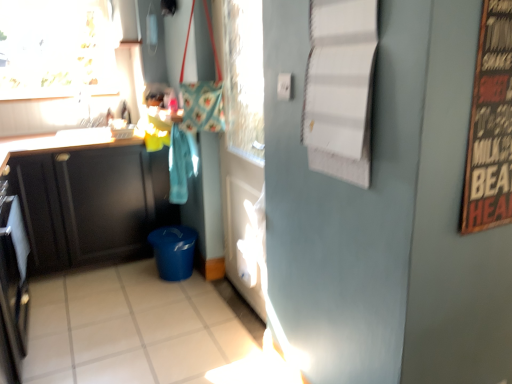
Question: Is wooden signboard at right not near matte black cabinet at left, which appears as the 2th cabinetry when viewed from the front?

Choices:
 (A) no
 (B) yes

Answer: (B)

Question: Can you confirm if wooden signboard at right is bigger than matte black cabinet at left, which is counted as the first cabinetry, starting from the back?

Choices:
 (A) yes
 (B) no

Answer: (B)

Question: Considering the relative sizes of wooden signboard at right and matte black cabinet at left, which appears as the 2th cabinetry when viewed from the front, in the image provided, is wooden signboard at right taller than matte black cabinet at left, which appears as the 2th cabinetry when viewed from the front,?

Choices:
 (A) no
 (B) yes

Answer: (A)

Question: Is wooden signboard at right positioned beyond the bounds of matte black cabinet at left, which appears as the 2th cabinetry when viewed from the front?

Choices:
 (A) yes
 (B) no

Answer: (A)

Question: Is wooden signboard at right behind matte black cabinet at left, which appears as the 2th cabinetry when viewed from the front?

Choices:
 (A) no
 (B) yes

Answer: (A)

Question: From the image's perspective, relative to white glossy tile at lower center, is matte black cabinet at left, which appears as the 2th cabinetry when viewed from the front, above or below?

Choices:
 (A) below
 (B) above

Answer: (B)

Question: Considering the positions of matte black cabinet at left, which is counted as the first cabinetry, starting from the back, and white glossy tile at lower center in the image, is matte black cabinet at left, which is counted as the first cabinetry, starting from the back, bigger or smaller than white glossy tile at lower center?

Choices:
 (A) small
 (B) big

Answer: (B)

Question: From a real-world perspective, relative to white glossy tile at lower center, is matte black cabinet at left, which appears as the 2th cabinetry when viewed from the front, vertically above or below?

Choices:
 (A) below
 (B) above

Answer: (B)

Question: Which is correct: matte black cabinet at left, which appears as the 2th cabinetry when viewed from the front, is inside white glossy tile at lower center, or outside of it?

Choices:
 (A) outside
 (B) inside

Answer: (A)

Question: Considering the positions of white glossy tile at lower center and matte black cabinet at left, the second cabinetry viewed from the back, in the image, is white glossy tile at lower center wider or thinner than matte black cabinet at left, the second cabinetry viewed from the back,?

Choices:
 (A) thin
 (B) wide

Answer: (B)

Question: Is point (247, 347) closer or farther from the camera than point (31, 145)?

Choices:
 (A) closer
 (B) farther

Answer: (A)

Question: Is white glossy tile at lower center taller or shorter than matte black cabinet at left, the first cabinetry from the front?

Choices:
 (A) short
 (B) tall

Answer: (A)

Question: Visually, is white glossy tile at lower center positioned to the left or to the right of matte black cabinet at left, the second cabinetry viewed from the back?

Choices:
 (A) right
 (B) left

Answer: (A)

Question: From a real-world perspective, relative to white glossy tile at lower center, is black stainless steel oven at left vertically above or below?

Choices:
 (A) below
 (B) above

Answer: (B)

Question: In terms of size, does black stainless steel oven at left appear bigger or smaller than white glossy tile at lower center?

Choices:
 (A) small
 (B) big

Answer: (A)